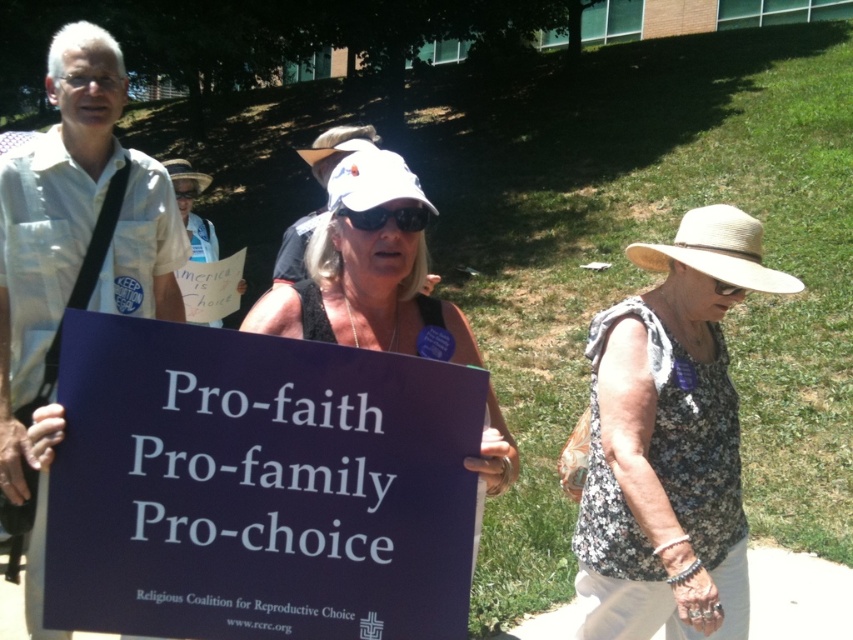
Question: Does floral fabric dress at right appear on the right side of white fabric hat at center?

Choices:
 (A) no
 (B) yes

Answer: (B)

Question: Is dark blue paper sign at center to the left of floral fabric dress at right from the viewer's perspective?

Choices:
 (A) yes
 (B) no

Answer: (A)

Question: Is dark blue paper sign at center wider than white fabric hat at center?

Choices:
 (A) yes
 (B) no

Answer: (A)

Question: Which point appears closest to the camera in this image?

Choices:
 (A) (262, 307)
 (B) (115, 369)
 (C) (706, 506)

Answer: (B)

Question: Which object is closer to the camera taking this photo?

Choices:
 (A) white fabric hat at center
 (B) floral fabric dress at right

Answer: (A)

Question: Considering the real-world distances, which object is closest to the white fabric hat at center?

Choices:
 (A) floral fabric dress at right
 (B) dark blue paper sign at center

Answer: (B)